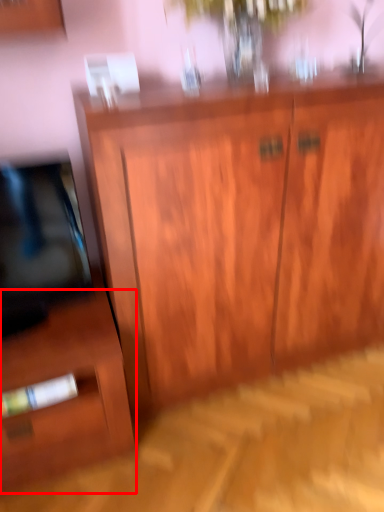
Question: From the image's perspective, what is the correct spatial relationship of side cabinet (annotated by the red box) in relation to cupboard?

Choices:
 (A) above
 (B) below

Answer: (B)